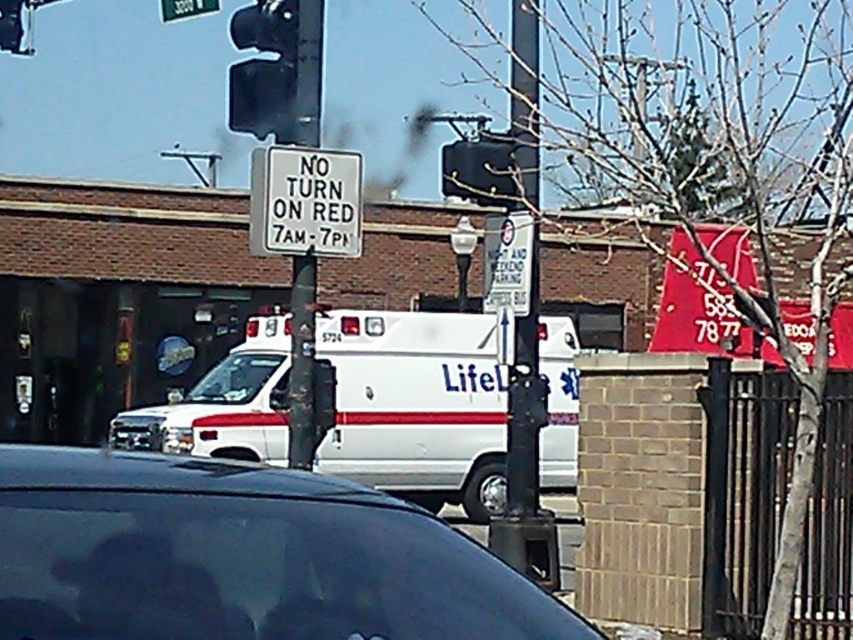
Question: Does white matte ambulance at center appear over white plastic sign at center?

Choices:
 (A) no
 (B) yes

Answer: (A)

Question: Which object appears farthest from the camera in this image?

Choices:
 (A) black metal pole at center
 (B) black plastic traffic light at upper center
 (C) white matte ambulance at center
 (D) green metallic street sign at upper center

Answer: (C)

Question: Which point is closer to the camera?

Choices:
 (A) (486, 262)
 (B) (468, 157)

Answer: (B)

Question: Considering the relative positions of metallic pole at center and white plastic sign at center in the image provided, where is metallic pole at center located with respect to white plastic sign at center?

Choices:
 (A) right
 (B) left

Answer: (B)

Question: Which object is farther from the camera taking this photo?

Choices:
 (A) green metallic street sign at upper center
 (B) black plastic traffic light at upper center
 (C) black metal pole at center
 (D) white matte ambulance at center

Answer: (D)

Question: Can you confirm if black glass traffic light at upper center is positioned to the right of black plastic traffic light at upper center?

Choices:
 (A) yes
 (B) no

Answer: (B)